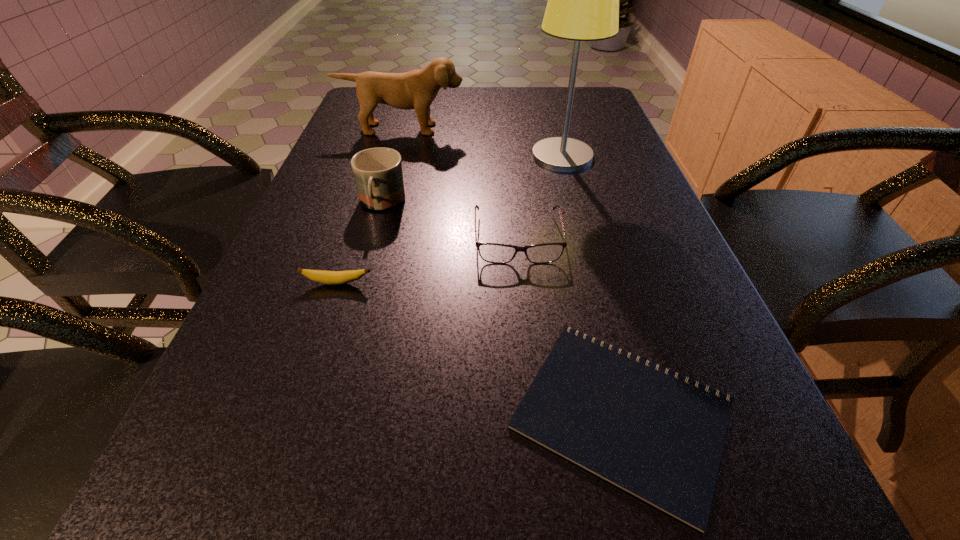
At what (x,y) coordinates should I click in order to perform the action: click on notepad positioned at the right edge. Please return your answer as a coordinate pair (x, y). Image resolution: width=960 pixels, height=540 pixels. Looking at the image, I should click on (660, 439).

Image resolution: width=960 pixels, height=540 pixels. What are the coordinates of `vacant space at the far edge` in the screenshot? It's located at (455, 116).

The width and height of the screenshot is (960, 540). In order to click on vacant space at the left edge of the desktop in this screenshot , I will do `click(273, 386)`.

The width and height of the screenshot is (960, 540). Find the location of `blank space at the right edge`. blank space at the right edge is located at coordinates (636, 231).

The image size is (960, 540). What are the coordinates of `free space at the far left corner of the desktop` in the screenshot? It's located at (357, 118).

In order to click on vacant space that's between the second nearest object and the table lamp in this screenshot , I will do 449,219.

What are the coordinates of `vacant area between the third shortest object and the shortest object` in the screenshot? It's located at (569, 326).

Identify the location of free spot between the farthest object and the tallest object. The image size is (960, 540). (482, 143).

Locate an element on the screen. The height and width of the screenshot is (540, 960). vacant space that is in between the spectacles and the second nearest object is located at coordinates (427, 260).

At what (x,y) coordinates should I click in order to perform the action: click on vacant area that lies between the second shortest object and the fifth nearest object. Please return your answer as a coordinate pair (x, y). The width and height of the screenshot is (960, 540). Looking at the image, I should click on (449, 219).